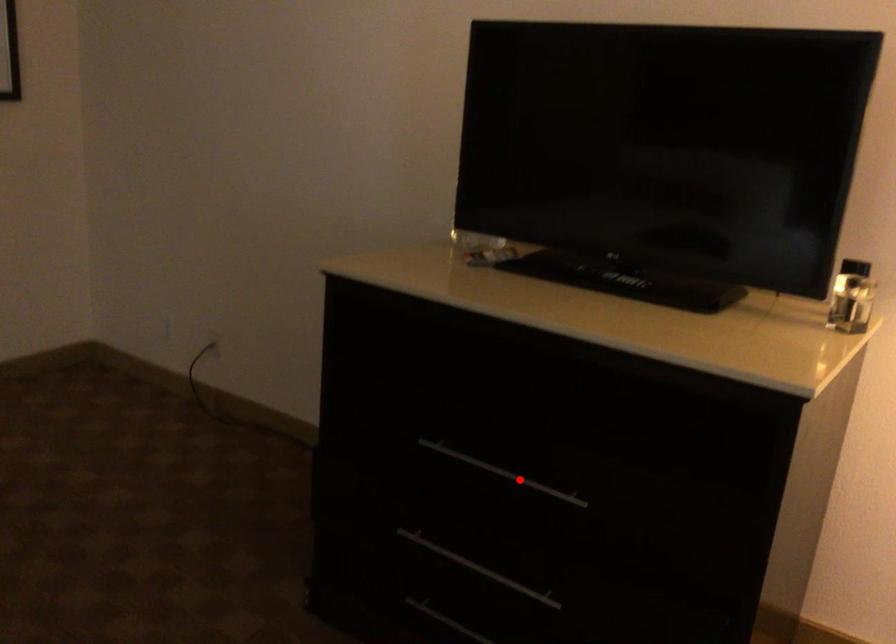
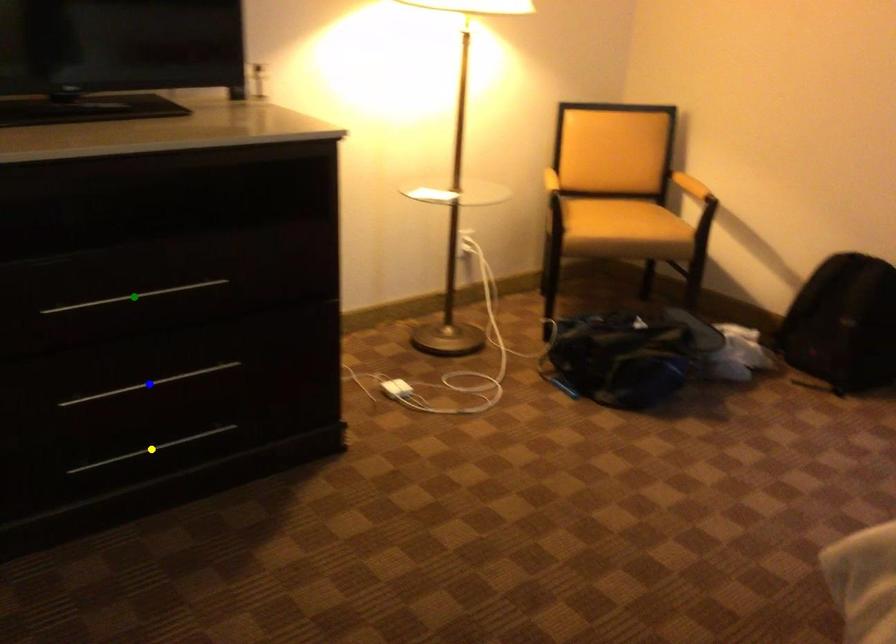
Question: I am providing you with two images of the same scene from different viewpoints. A red point is marked on the first image. You are given multiple points on the second image. Which mark in image 2 goes with the point in image 1?

Choices:
 (A) green point
 (B) yellow point
 (C) blue point

Answer: (A)